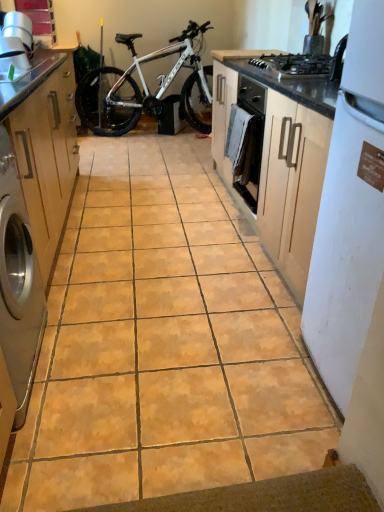
Question: Can you confirm if satin silver washing machine at left is thinner than white matte refrigerator at right?

Choices:
 (A) no
 (B) yes

Answer: (B)

Question: Considering the relative sizes of satin silver washing machine at left and white matte refrigerator at right in the image provided, is satin silver washing machine at left shorter than white matte refrigerator at right?

Choices:
 (A) no
 (B) yes

Answer: (B)

Question: Is satin silver washing machine at left closer to camera compared to white matte refrigerator at right?

Choices:
 (A) no
 (B) yes

Answer: (A)

Question: Does satin silver washing machine at left have a greater width compared to white matte refrigerator at right?

Choices:
 (A) yes
 (B) no

Answer: (B)

Question: Is white matte refrigerator at right a part of satin silver washing machine at left?

Choices:
 (A) yes
 (B) no

Answer: (B)

Question: Does satin silver washing machine at left have a smaller size compared to white matte refrigerator at right?

Choices:
 (A) no
 (B) yes

Answer: (B)

Question: Is matte wood cabinet at left aimed at white matte bicycle at center?

Choices:
 (A) yes
 (B) no

Answer: (B)

Question: Considering the relative sizes of matte wood cabinet at left and white matte bicycle at center in the image provided, is matte wood cabinet at left bigger than white matte bicycle at center?

Choices:
 (A) no
 (B) yes

Answer: (B)

Question: Is white matte bicycle at center located within matte wood cabinet at left?

Choices:
 (A) yes
 (B) no

Answer: (B)

Question: Is matte wood cabinet at left positioned beyond the bounds of white matte bicycle at center?

Choices:
 (A) yes
 (B) no

Answer: (A)

Question: From a real-world perspective, is matte wood cabinet at left located higher than white matte bicycle at center?

Choices:
 (A) no
 (B) yes

Answer: (A)

Question: From the image's perspective, would you say matte wood cabinet at left is shown under white matte bicycle at center?

Choices:
 (A) no
 (B) yes

Answer: (B)

Question: From the image's perspective, does white matte refrigerator at right appear higher than matte wood cabinet at left?

Choices:
 (A) yes
 (B) no

Answer: (B)